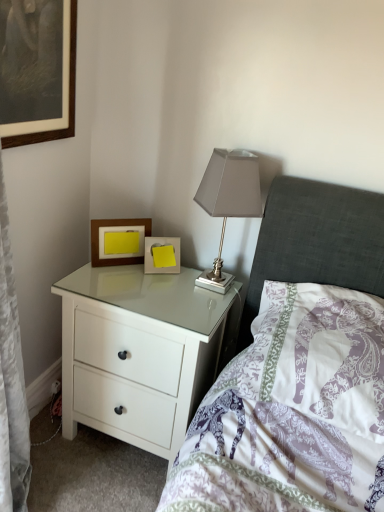
Question: Based on their positions, is purple printed pillow at center located to the left or right of wooden framed picture at upper left, which is the third picture frame from right to left?

Choices:
 (A) left
 (B) right

Answer: (B)

Question: From a real-world perspective, is purple printed pillow at center above or below wooden framed picture at upper left, the 1th picture frame viewed from the left?

Choices:
 (A) above
 (B) below

Answer: (B)

Question: Which object is the closest to the satin silver table lamp at upper right?

Choices:
 (A) white glossy chest of drawers at center
 (B) purple printed pillow at center
 (C) yellow paper at center, the 1th picture frame in the bottom-to-top sequence
 (D) wooden framed picture at upper left, the first picture frame in the top-to-bottom sequence
 (E) wooden picture frame at upper left, which is the second picture frame from bottom to top

Answer: (C)

Question: Which of these objects is positioned closest to the purple printed pillow at center?

Choices:
 (A) wooden picture frame at upper left, positioned as the 2th picture frame in left-to-right order
 (B) white glossy chest of drawers at center
 (C) wooden framed picture at upper left, which is the third picture frame from right to left
 (D) satin silver table lamp at upper right
 (E) yellow paper at center, the 1th picture frame in the bottom-to-top sequence

Answer: (B)